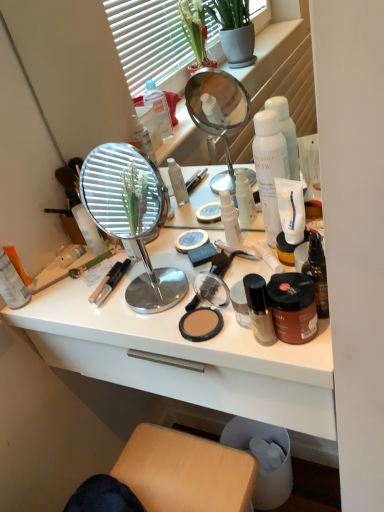
Find the location of a particular element. This screenshot has width=384, height=512. vacant area that lies between orange matte lotion at left, the 5th toiletry positioned from the right, and matte black foundation at center, which is the third toiletry from right to left is located at coordinates (112, 319).